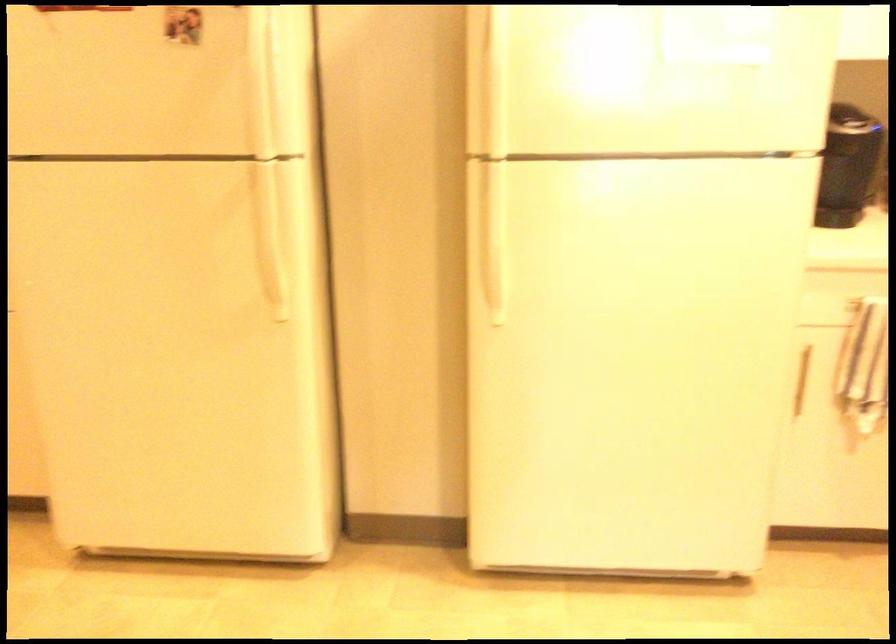
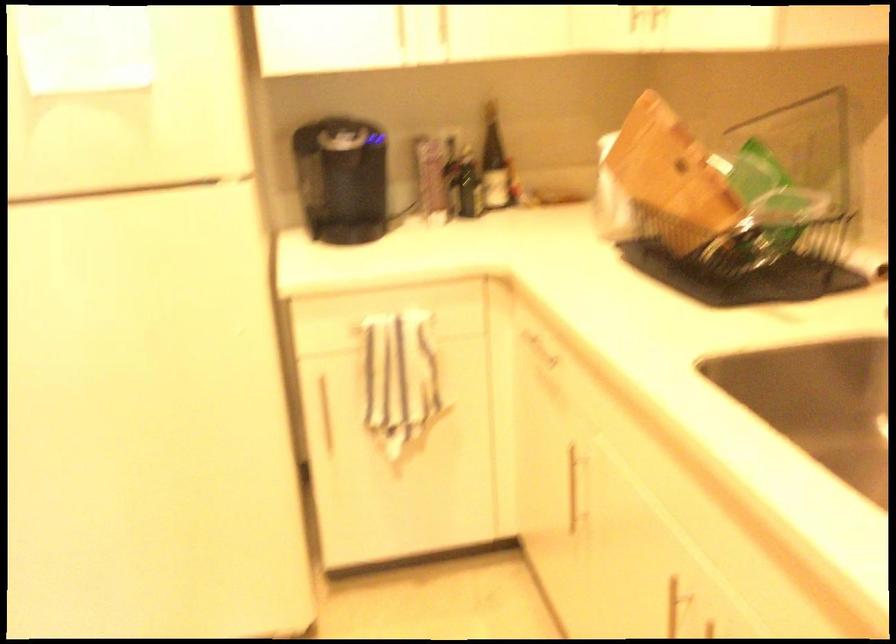
Question: The first image is from the beginning of the video and the second image is from the end. How did the camera likely rotate when shooting the video?

Choices:
 (A) Left
 (B) Right
 (C) Up
 (D) Down

Answer: (B)